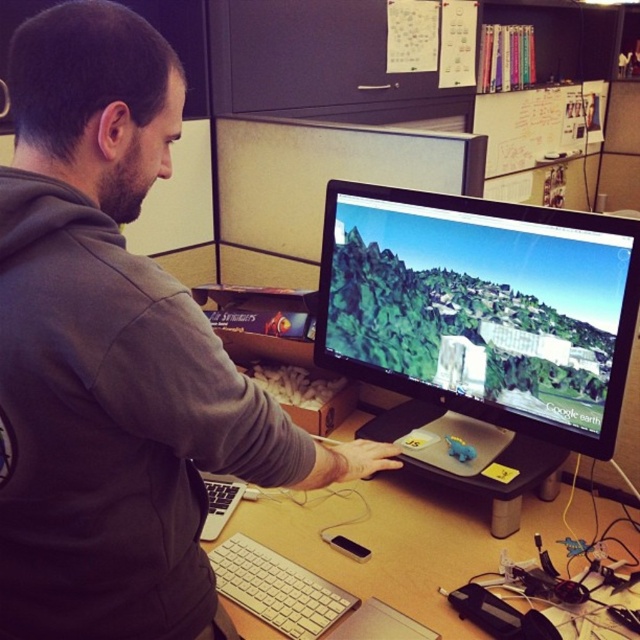
You need to place a new mouse that is 12 cm tall on the desk. Considering the space between the matte black monitor at center and the silver metallic keyboard at lower center, will the mouse fit vertically between them?

The matte black monitor at center is taller than the silver metallic keyboard at lower center, so the mouse might fit vertically between them, but the exact vertical space isn

You are a delivery person who needs to place a new monitor on the desk. The new monitor is taller than the current matte black monitor at center. Will the gray matte hoodie at center block the view of the new monitor?

The gray matte hoodie at center has a greater height compared to the matte black monitor at center. Since the new monitor is taller than the current one, it might still be blocked by the hoodie if placed in the same position. However, without knowing the exact height of the new monitor, it is uncertain. The current hoodie is taller than the existing monitor, so if the new monitor surpasses the hoodie height, it would not be blocked.

From the picture: You are organizing the desk and need to place a new item between the matte black monitor at center and the wooden desk at center. Considering their sizes, which one should you place the item closer to?

The matte black monitor at center is much taller than the wooden desk at center, so you should place the new item closer to the wooden desk at center to ensure stability and avoid blocking the monitor.